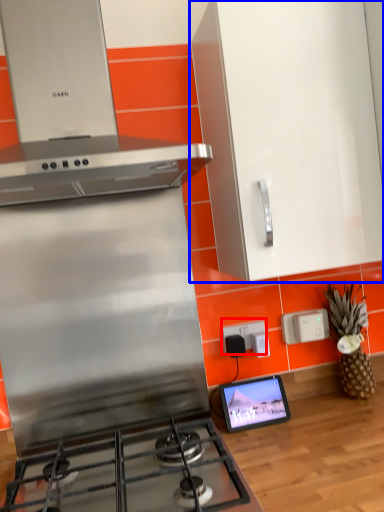
Question: Which point is further to the camera, electric outlet (highlighted by a red box) or cabinetry (highlighted by a blue box)?

Choices:
 (A) electric outlet
 (B) cabinetry

Answer: (A)